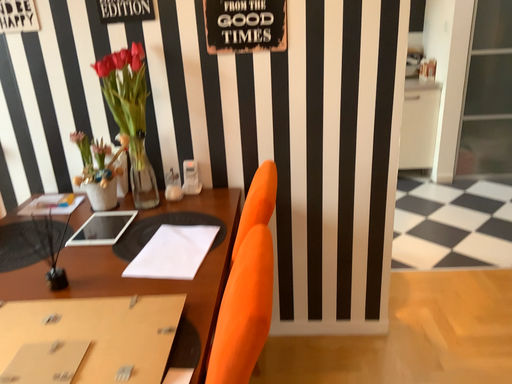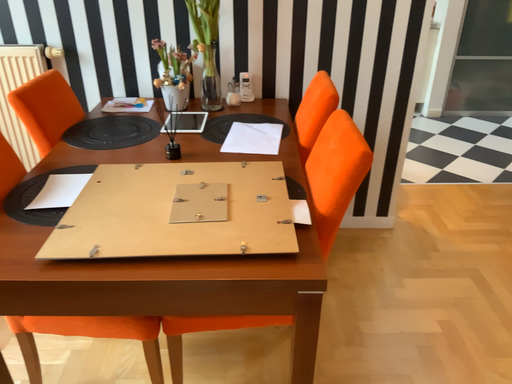
Question: Which way did the camera rotate in the video?

Choices:
 (A) rotated upward
 (B) rotated downward

Answer: (B)